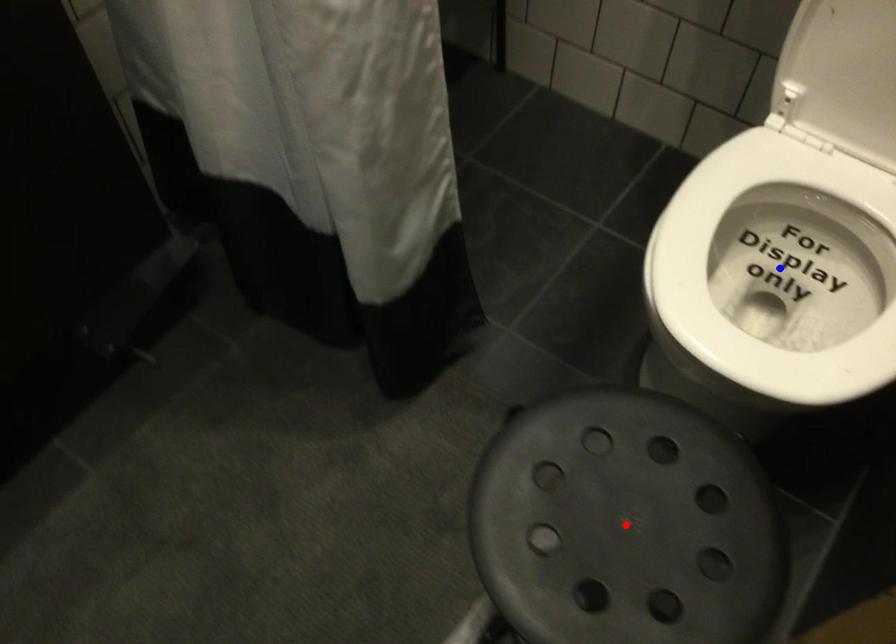
Question: Two points are marked on the image. Which point is closer to the camera?

Choices:
 (A) Blue point is closer.
 (B) Red point is closer.

Answer: (B)